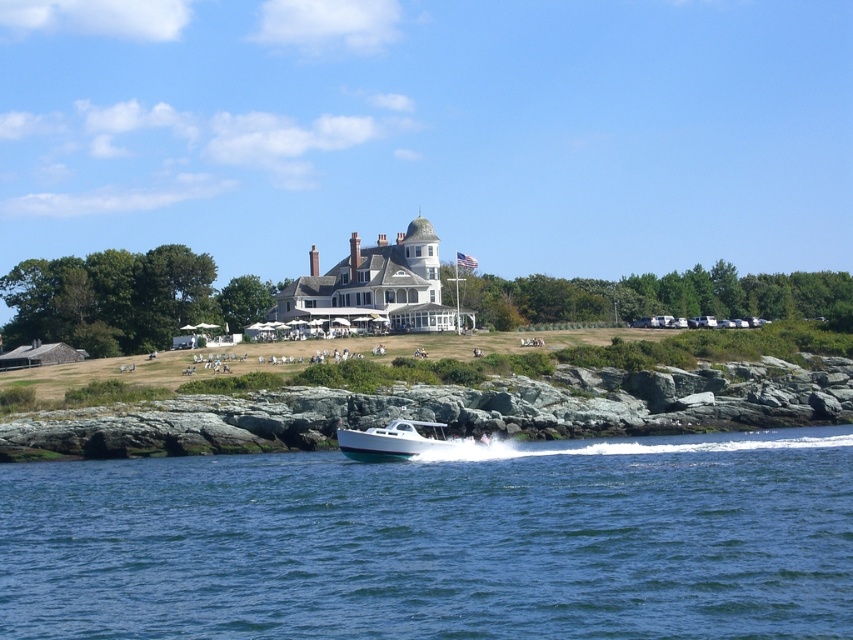
Question: Which object is farther from the camera taking this photo?

Choices:
 (A) blue water at lower center
 (B) white glossy boat at center
 (C) white wooden mansion at center

Answer: (C)

Question: Does blue water at lower center appear under white wooden mansion at center?

Choices:
 (A) no
 (B) yes

Answer: (B)

Question: From the image, what is the correct spatial relationship of blue water at lower center in relation to white wooden mansion at center?

Choices:
 (A) right
 (B) left

Answer: (A)

Question: Can you confirm if white wooden mansion at center is positioned to the right of white glossy boat at center?

Choices:
 (A) no
 (B) yes

Answer: (A)

Question: Which point is farther from the camera taking this photo?

Choices:
 (A) (331, 321)
 (B) (447, 440)

Answer: (A)

Question: Which object is positioned closest to the white glossy boat at center?

Choices:
 (A) white wooden mansion at center
 (B) blue water at lower center

Answer: (B)